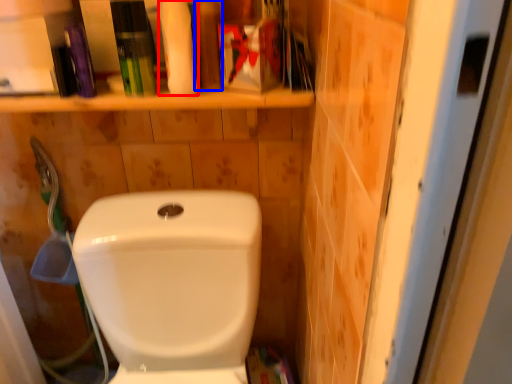
Question: Which point is closer to the camera, cleaning product (highlighted by a red box) or toiletry (highlighted by a blue box)?

Choices:
 (A) cleaning product
 (B) toiletry

Answer: (A)